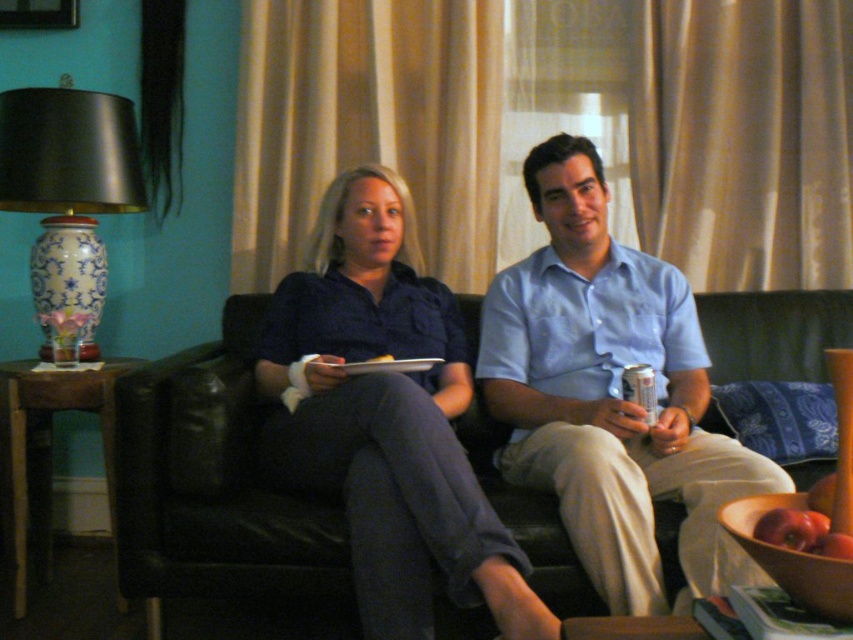
Does black leather couch at center appear on the left side of blue and white porcelain vase at left?

Incorrect, black leather couch at center is not on the left side of blue and white porcelain vase at left.

What do you see at coordinates (216, 486) in the screenshot? I see `black leather couch at center` at bounding box center [216, 486].

Is point (482, 628) less distant than point (50, 140)?

Yes, it is in front of point (50, 140).

The height and width of the screenshot is (640, 853). Find the location of `black leather couch at center`. black leather couch at center is located at coordinates (216, 486).

Which of these two, matte blue shirt at center or blue and white porcelain vase at left, stands taller?

With more height is matte blue shirt at center.

Measure the distance from matte blue shirt at center to blue and white porcelain vase at left.

matte blue shirt at center and blue and white porcelain vase at left are 29.86 inches apart from each other.

Between point (316, 378) and point (44, 148), which one is positioned behind?

Point (44, 148)

Identify the location of matte blue shirt at center. The image size is (853, 640). (387, 419).

Which is below, light blue cotton shirt at center or matte blue shirt at center?

matte blue shirt at center

Does point (656, 436) come closer to viewer compared to point (372, 317)?

Yes, it is in front of point (372, 317).

Where is `light blue cotton shirt at center`? This screenshot has width=853, height=640. light blue cotton shirt at center is located at coordinates (610, 394).